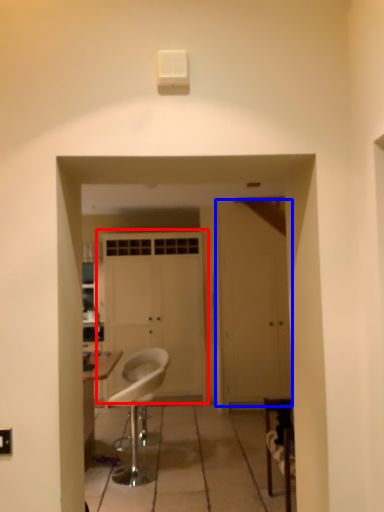
Question: Which object is further to the camera taking this photo, door (highlighted by a red box) or door (highlighted by a blue box)?

Choices:
 (A) door
 (B) door

Answer: (A)